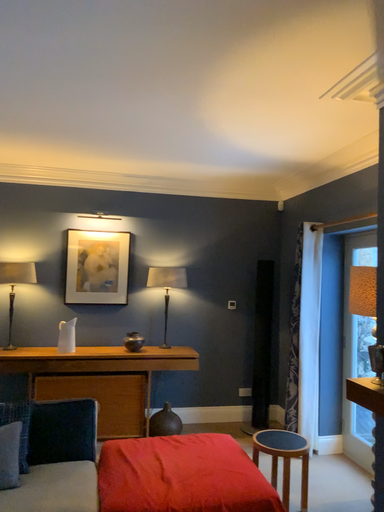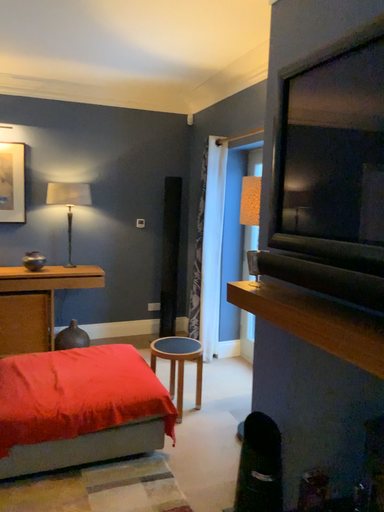
Question: Which way did the camera rotate in the video?

Choices:
 (A) rotated downward
 (B) rotated upward

Answer: (A)